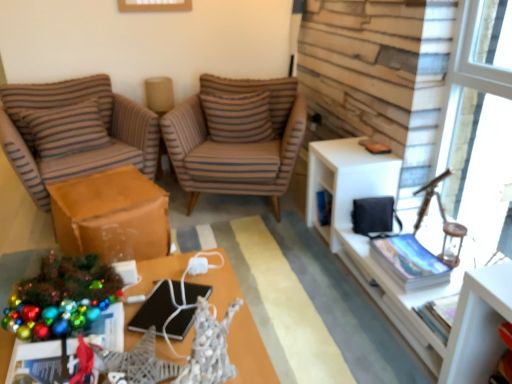
Question: In the image, is metallic silver desk at center on the left side or the right side of brown striped pillow at center, which is the second pillow in left-to-right order?

Choices:
 (A) right
 (B) left

Answer: (B)

Question: Relative to brown striped pillow at center, the first pillow in the right-to-left sequence, is metallic silver desk at center in front or behind?

Choices:
 (A) behind
 (B) front

Answer: (B)

Question: Which of these objects is positioned farthest from the brown striped fabric chair at left, positioned as the second chair in right-to-left order?

Choices:
 (A) brown striped fabric chair at center, arranged as the first chair when viewed from the right
 (B) metallic silver desk at center
 (C) white matte cabinet at right
 (D) black matte laptop at center
 (E) transparent glass window at upper right

Answer: (E)

Question: Which of these objects is positioned farthest from the brown striped fabric chair at left, positioned as the second chair in right-to-left order?

Choices:
 (A) brown paper bag at lower left
 (B) brown striped pillow at center, the first pillow in the right-to-left sequence
 (C) transparent glass window at upper right
 (D) black matte laptop at center
 (E) brown striped fabric chair at center, arranged as the first chair when viewed from the right

Answer: (C)